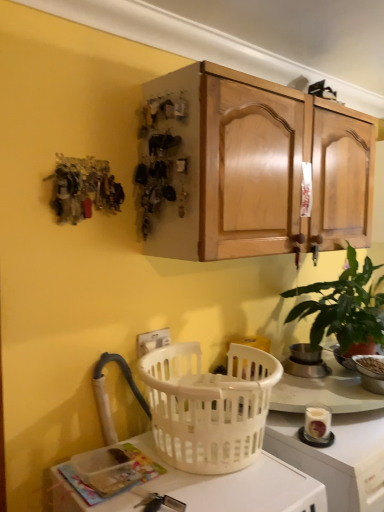
Find the location of a particular element. Image resolution: width=384 pixels, height=512 pixels. vacant area on top of white plastic basket at lower center (from a real-world perspective) is located at coordinates (189, 475).